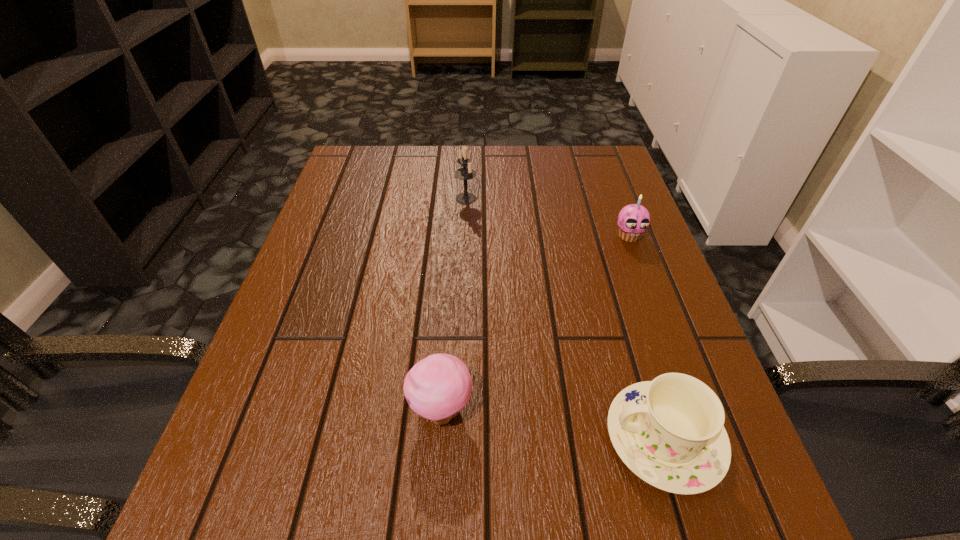
Locate an element on the screen. vacant space in between the third nearest object and the left cupcake is located at coordinates (535, 323).

Where is `the closest object to the farther cupcake`? Image resolution: width=960 pixels, height=540 pixels. the closest object to the farther cupcake is located at coordinates (464, 173).

The height and width of the screenshot is (540, 960). What are the coordinates of `the second closest object to the chinaware` in the screenshot? It's located at (634, 219).

Where is `vacant region that satisfies the following two spatial constraints: 1. on the face of the second farthest object; 2. on the handle side of the chinaware`? This screenshot has height=540, width=960. vacant region that satisfies the following two spatial constraints: 1. on the face of the second farthest object; 2. on the handle side of the chinaware is located at coordinates (705, 438).